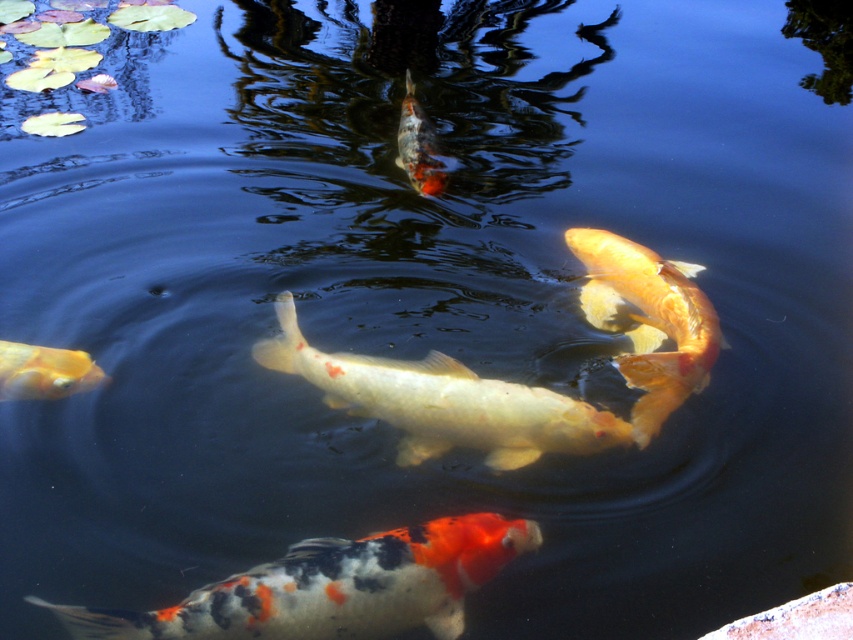
Who is shorter, speckled orange and white fish at center or shiny gold fish at left?

Standing shorter between the two is shiny gold fish at left.

Which is in front, point (492, 566) or point (33, 362)?

Positioned in front is point (492, 566).

The width and height of the screenshot is (853, 640). Describe the element at coordinates (334, 588) in the screenshot. I see `speckled orange and white fish at center` at that location.

You are a GUI agent. You are given a task and a screenshot of the screen. Output one action in this format:
    pyautogui.click(x=<x>, y=<y>)
    Task: Click on the speckled orange and white fish at center
    The image size is (853, 640).
    Given the screenshot: What is the action you would take?
    pyautogui.click(x=334, y=588)

Which of these two, shiny gold fish at left or orange and white speckled goldfish at upper center, stands shorter?

Standing shorter between the two is shiny gold fish at left.

Find the location of a particular element. Image resolution: width=853 pixels, height=640 pixels. shiny gold fish at left is located at coordinates (44, 371).

Who is more distant from viewer, (643, 301) or (0, 342)?

The point (643, 301) is more distant.

Image resolution: width=853 pixels, height=640 pixels. What do you see at coordinates (654, 321) in the screenshot?
I see `shiny orange fish at center` at bounding box center [654, 321].

Which is in front, point (624, 289) or point (45, 396)?

Point (45, 396) is in front.

Find the location of a particular element. shiny orange fish at center is located at coordinates (654, 321).